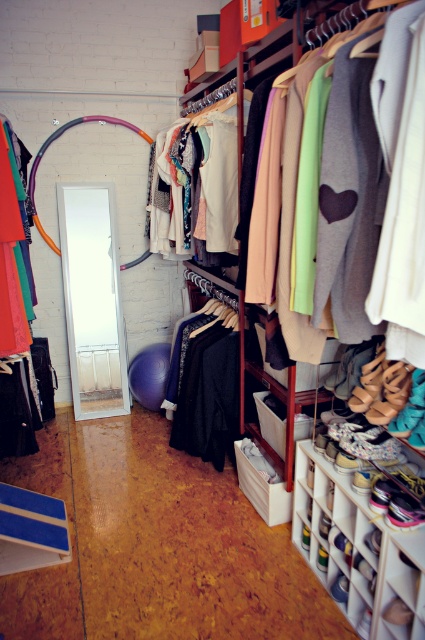
Based on the photo, you are organizing your closet and want to place a new accessory on the shelf behind the matte fabric clothes at center. Can you do this without moving the white plastic shoe rack at lower right?

The matte fabric clothes at center is in front of the white plastic shoe rack at lower right, so the shelf behind the matte fabric clothes at center is actually behind the shoe rack. Therefore, you can place the accessory there without moving the white plastic shoe rack at lower right.

You are organizing clothes in a closet and need to determine which item is taller between the matte fabric clothes at center and the matte orange fabric at left. Which one is taller?

The matte fabric clothes at center is taller than the matte orange fabric at left.

You are standing in the closet and want to place a new hanger between the two points, point (396, 637) and point (6, 209). Which point should you place it closer to so it is in front of the other point?

You should place the hanger closer to point (396, 637) because it is in front of point (6, 209).